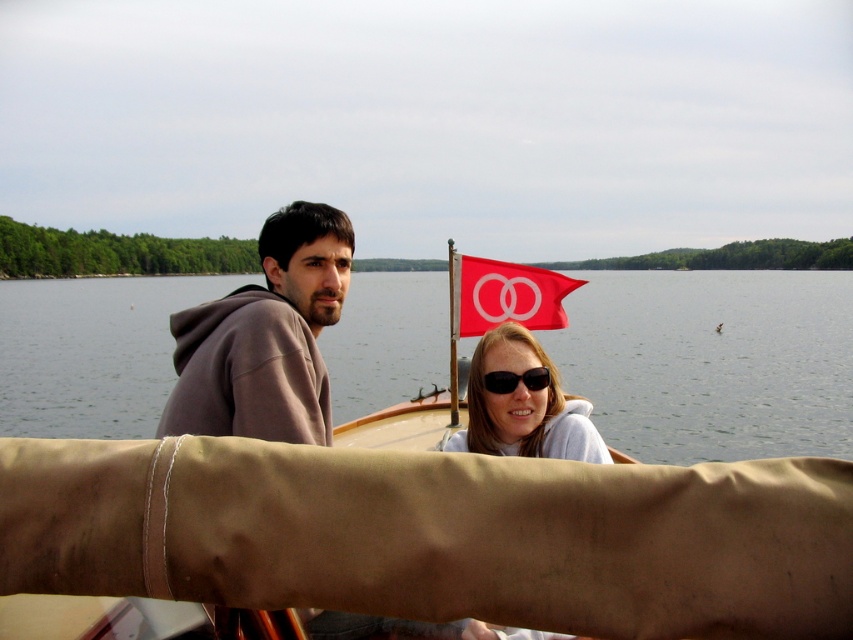
Question: Which of the following is the farthest from the observer?

Choices:
 (A) (479, 413)
 (B) (503, 454)
 (C) (503, 376)
 (D) (387, 403)

Answer: (D)

Question: Is clear water at center positioned behind black plastic sunglasses at center?

Choices:
 (A) no
 (B) yes

Answer: (A)

Question: Among these points, which one is farthest from the camera?

Choices:
 (A) (566, 289)
 (B) (51, 381)
 (C) (469, 449)

Answer: (B)

Question: Which point is farther from the camera taking this photo?

Choices:
 (A) (490, 378)
 (B) (486, 372)

Answer: (B)

Question: Is clear water at center above brown hoodie at center?

Choices:
 (A) no
 (B) yes

Answer: (B)

Question: Can you confirm if clear water at center is positioned below matte white sunglasses at center?

Choices:
 (A) yes
 (B) no

Answer: (B)